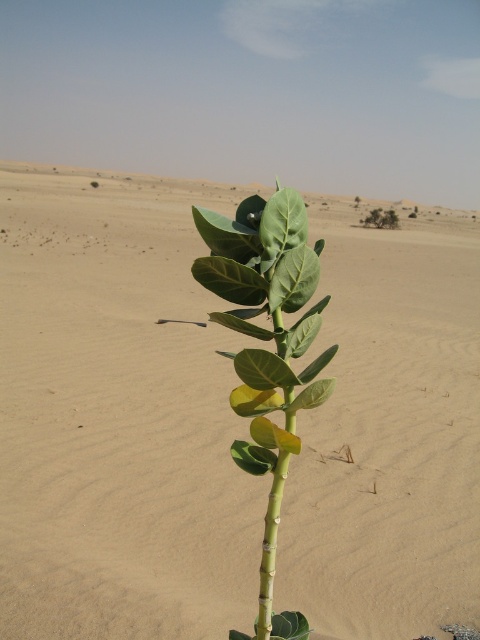
Question: Which of the following is the closest to the observer?

Choices:
 (A) (375, 220)
 (B) (277, 406)

Answer: (B)

Question: In this image, where is sandy beige sand at center located relative to green matte leaf at upper center?

Choices:
 (A) below
 (B) above

Answer: (A)

Question: Observing the image, what is the correct spatial positioning of green matte leafy plant at center in reference to green matte leaf at upper center?

Choices:
 (A) right
 (B) left

Answer: (B)

Question: Can you confirm if green matte leafy plant at center is positioned above green matte leaf at upper center?

Choices:
 (A) no
 (B) yes

Answer: (A)

Question: Which of the following is the farthest from the observer?

Choices:
 (A) sandy beige sand at center
 (B) green matte leafy plant at center

Answer: (A)

Question: Which point is closer to the camera?

Choices:
 (A) (255, 412)
 (B) (386, 212)
 (C) (9, 314)
 (D) (290, 394)

Answer: (D)